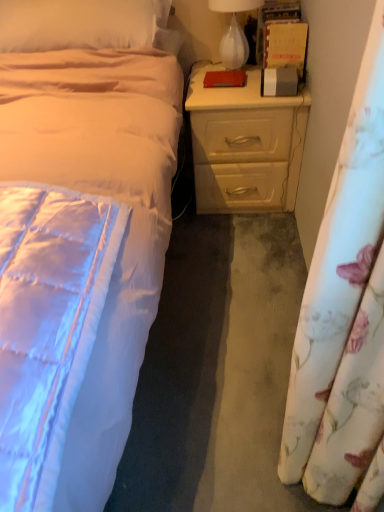
The image size is (384, 512). I want to click on free space in front of white glass lamp at upper right, so click(x=225, y=89).